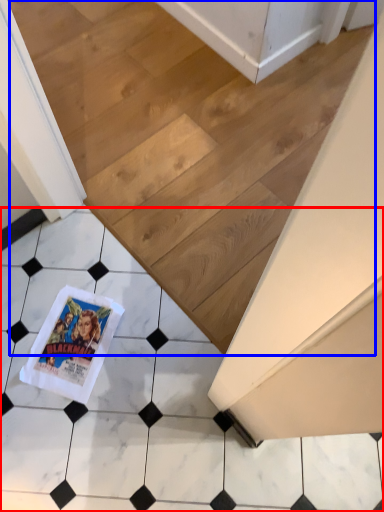
Question: Which point is closer to the camera, tile (highlighted by a red box) or stairwell (highlighted by a blue box)?

Choices:
 (A) tile
 (B) stairwell

Answer: (A)